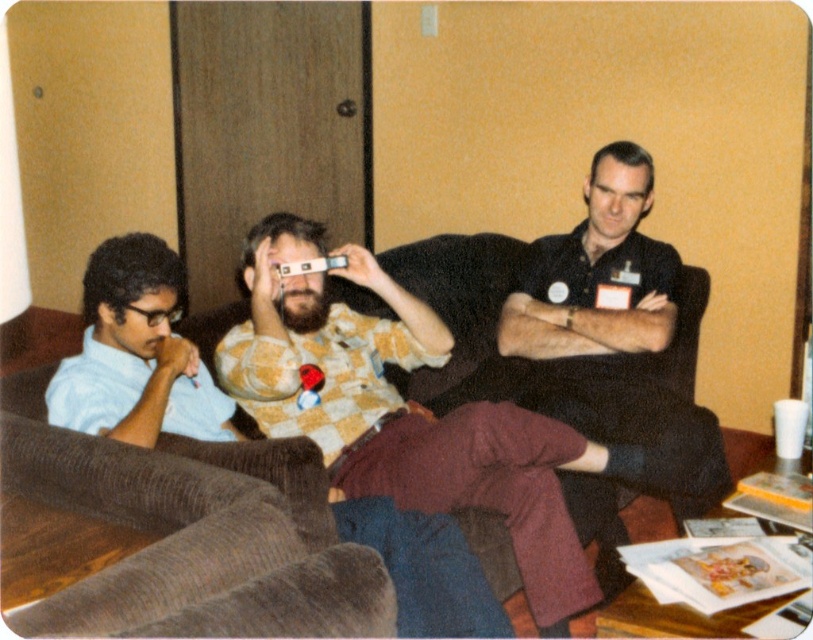
This screenshot has width=813, height=640. Describe the element at coordinates (190, 531) in the screenshot. I see `brown fabric couch at center` at that location.

Consider the image. Which of these two, brown fabric couch at center or black matte shirt at center, stands taller?

Standing taller between the two is black matte shirt at center.

Identify the location of brown fabric couch at center. coord(190,531).

Consider the image. Who is more distant from viewer, (x=524, y=378) or (x=148, y=435)?

Point (x=524, y=378)

Which of these two, brown fabric couch at center or light blue shirt at left, stands shorter?

brown fabric couch at center is shorter.

Is point (272, 582) farther from viewer compared to point (198, 356)?

No, (272, 582) is closer to viewer.

I want to click on brown fabric couch at center, so click(190, 531).

Between point (668, 388) and point (107, 378), which one is positioned in front?

Point (107, 378) is more forward.

Does point (590, 358) come behind point (125, 276)?

Yes, point (590, 358) is behind point (125, 276).

Which is behind, point (718, 460) or point (138, 387)?

The point (718, 460) is more distant.

Where is `black matte shirt at center`? The image size is (813, 640). black matte shirt at center is located at coordinates 614,337.